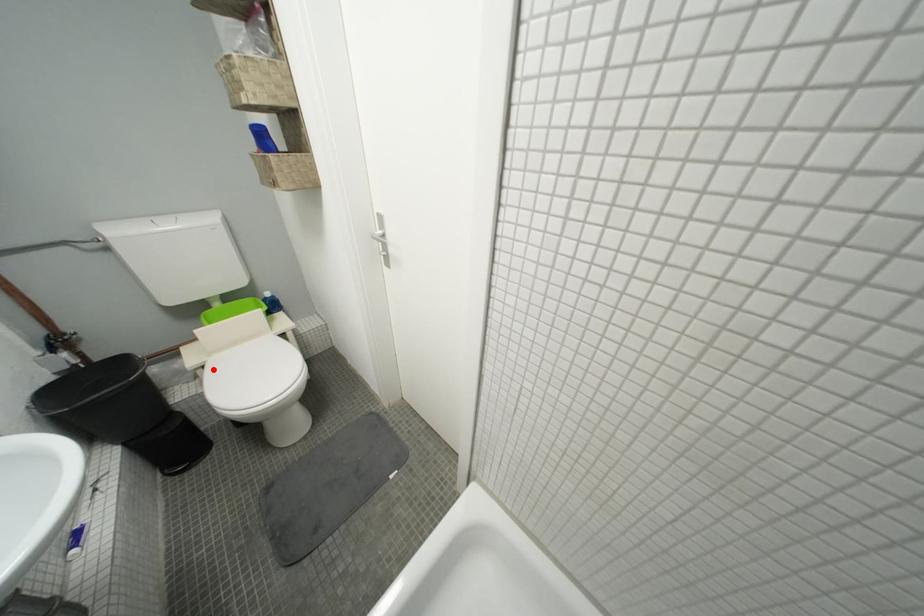
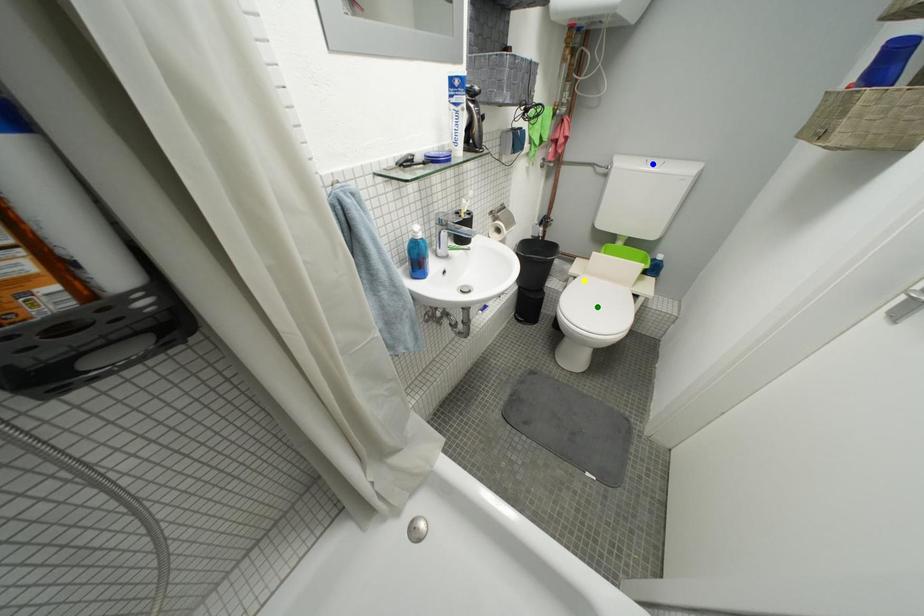
Question: I am providing you with two images of the same scene from different viewpoints. A red point is marked on the first image. You are given multiple points on the second image. Which point in image 2 represents the same 3d spot as the red point in image 1?

Choices:
 (A) blue point
 (B) green point
 (C) yellow point

Answer: (C)